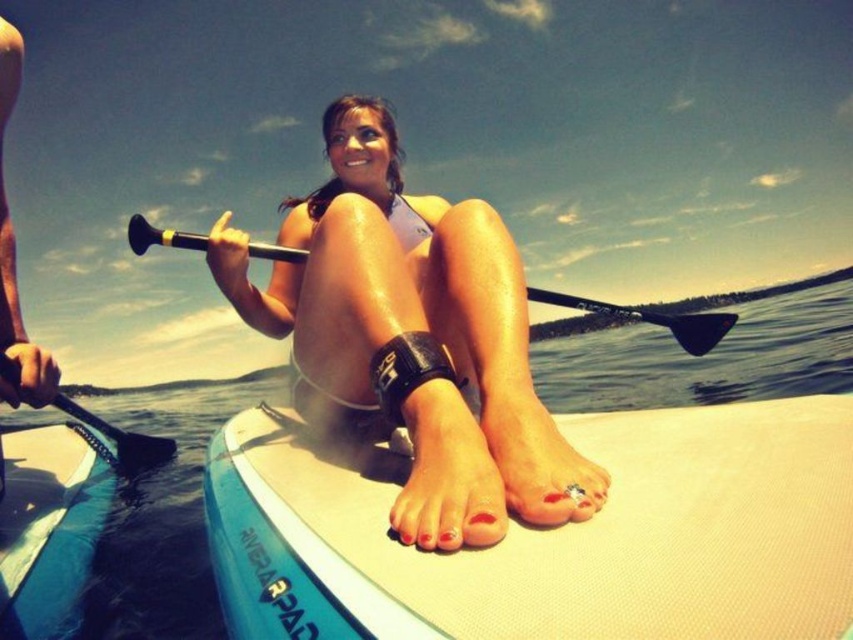
Question: Can you confirm if black rubber paddle at center is thinner than black rubber paddle at left?

Choices:
 (A) no
 (B) yes

Answer: (B)

Question: Which object is farther from the camera taking this photo?

Choices:
 (A) blue glossy canoe at lower left
 (B) black rubber paddle at center
 (C) matte white surfboard at center
 (D) white textured surfboard at center

Answer: (B)

Question: Which point is farther from the camera taking this photo?

Choices:
 (A) (131, 454)
 (B) (248, 435)
 (C) (358, 392)
 (D) (9, 605)

Answer: (A)

Question: Can you confirm if black rubber paddle at center is positioned to the left of black rubber paddle at left?

Choices:
 (A) yes
 (B) no

Answer: (B)

Question: Which is nearer to the matte white surfboard at center?

Choices:
 (A) blue glossy canoe at lower left
 (B) white textured surfboard at center

Answer: (B)

Question: Is blue glossy canoe at lower left below black rubber paddle at left?

Choices:
 (A) yes
 (B) no

Answer: (A)